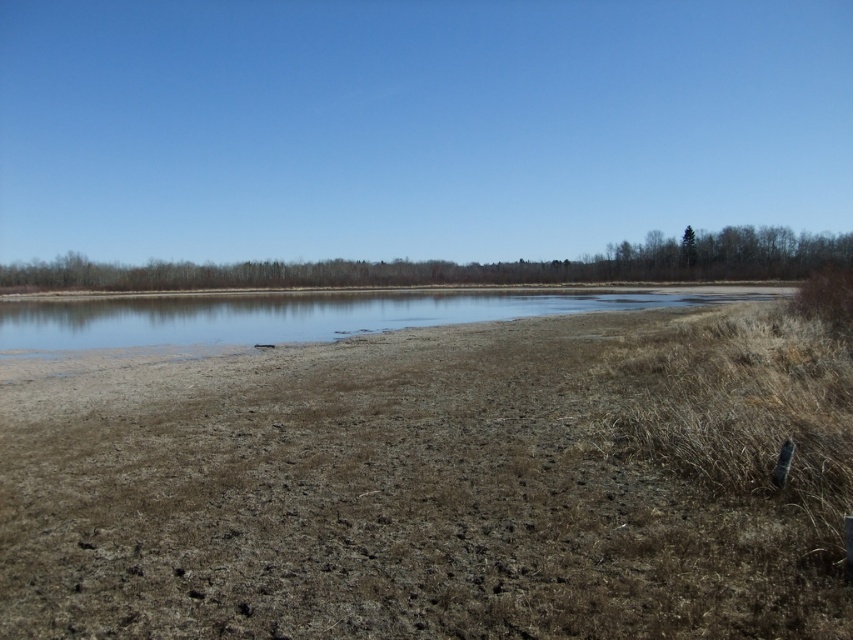
You are standing at the edge of the lake and notice the brown dry grass at center and the clear water at center. Which of these two features covers a smaller area in the scene?

The brown dry grass at center has a smaller size compared to the clear water at center, so it covers a smaller area in the scene.

You are standing at the edge of the water in the serene landscape scene. You notice two points marked in the image. Which of the two points, point (815, 349) or point (64, 332), is closer to your current position?

Point (815, 349) is closer to the viewer than point (64, 332), so the point closer to your current position is point (815, 349).

You are a hiker trying to cross the area shown in the image. You need to step on the brown dry grass at center and the clear water at center. Which surface will require you to bend your knees more due to its height?

The clear water at center is taller than the brown dry grass at center, so stepping on the clear water at center will require bending your knees more because it is higher.